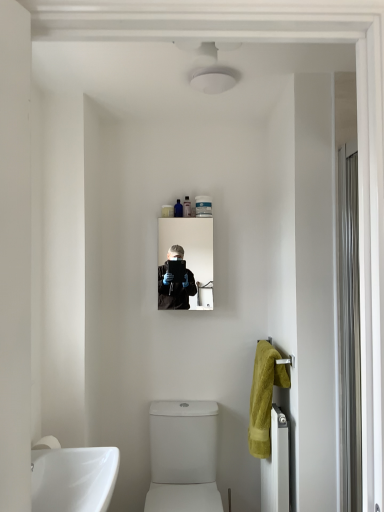
Question: Is translucent plastic tube at upper center, which is counted as the second toiletry, starting from the right, smaller than white glossy toilet at lower center?

Choices:
 (A) yes
 (B) no

Answer: (A)

Question: Is white glossy toilet at lower center at the back of translucent plastic tube at upper center, which is counted as the second toiletry, starting from the right?

Choices:
 (A) no
 (B) yes

Answer: (A)

Question: Considering the relative positions of translucent plastic tube at upper center, which is counted as the second toiletry, starting from the right, and white glossy toilet at lower center in the image provided, is translucent plastic tube at upper center, which is counted as the second toiletry, starting from the right, to the right of white glossy toilet at lower center from the viewer's perspective?

Choices:
 (A) no
 (B) yes

Answer: (B)

Question: From the image's perspective, is translucent plastic tube at upper center, which is counted as the second toiletry, starting from the right, over white glossy toilet at lower center?

Choices:
 (A) yes
 (B) no

Answer: (A)

Question: From the image's perspective, is translucent plastic tube at upper center, which is counted as the second toiletry, starting from the right, beneath white glossy toilet at lower center?

Choices:
 (A) yes
 (B) no

Answer: (B)

Question: Is translucent plastic tube at upper center, which is counted as the second toiletry, starting from the right, in front of white glossy toilet at lower center?

Choices:
 (A) yes
 (B) no

Answer: (B)

Question: From a real-world perspective, is white metallic radiator at lower right positioned under translucent plastic tube at upper center, which is counted as the second toiletry, starting from the right, based on gravity?

Choices:
 (A) no
 (B) yes

Answer: (B)

Question: Is white metallic radiator at lower right taller than translucent plastic tube at upper center, the second toiletry viewed from the left?

Choices:
 (A) yes
 (B) no

Answer: (A)

Question: Can we say white metallic radiator at lower right lies outside translucent plastic tube at upper center, which is counted as the second toiletry, starting from the right?

Choices:
 (A) yes
 (B) no

Answer: (A)

Question: Is white metallic radiator at lower right facing towards translucent plastic tube at upper center, which is counted as the second toiletry, starting from the right?

Choices:
 (A) yes
 (B) no

Answer: (B)

Question: Can you confirm if white metallic radiator at lower right is positioned to the right of translucent plastic tube at upper center, which is counted as the second toiletry, starting from the right?

Choices:
 (A) no
 (B) yes

Answer: (B)

Question: Is the depth of white metallic radiator at lower right greater than that of translucent plastic tube at upper center, which is counted as the second toiletry, starting from the right?

Choices:
 (A) yes
 (B) no

Answer: (B)

Question: Can you confirm if soft yellow towel at right is positioned to the right of white matte tube at upper center, placed as the third toiletry when sorted from left to right?

Choices:
 (A) yes
 (B) no

Answer: (A)